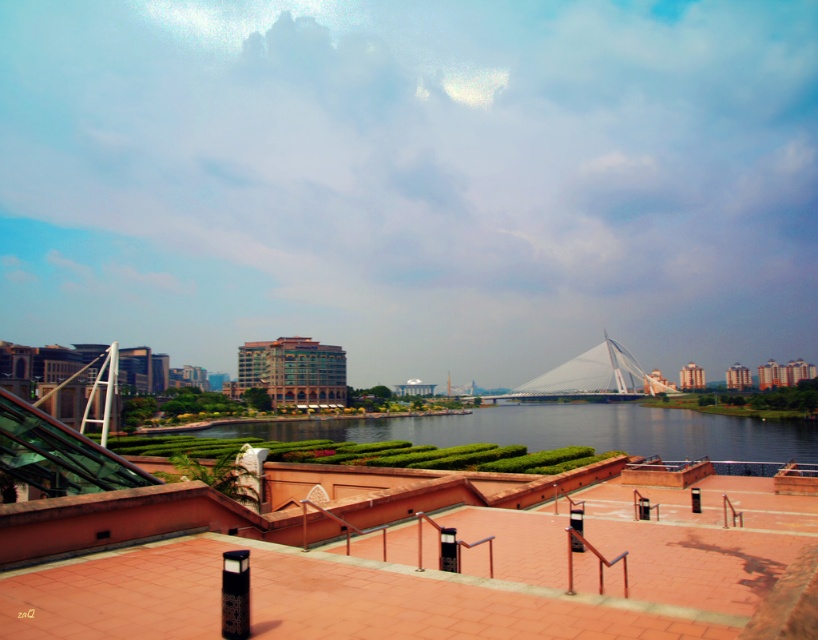
Question: Does green grassy river at center have a smaller size compared to white glass bridge at center?

Choices:
 (A) no
 (B) yes

Answer: (A)

Question: Which object appears farthest from the camera in this image?

Choices:
 (A) green grassy river at center
 (B) white glass bridge at center

Answer: (B)

Question: Can you confirm if green grassy river at center is positioned to the left of white glass bridge at center?

Choices:
 (A) no
 (B) yes

Answer: (B)

Question: Does green grassy river at center have a smaller size compared to white glass bridge at center?

Choices:
 (A) no
 (B) yes

Answer: (A)